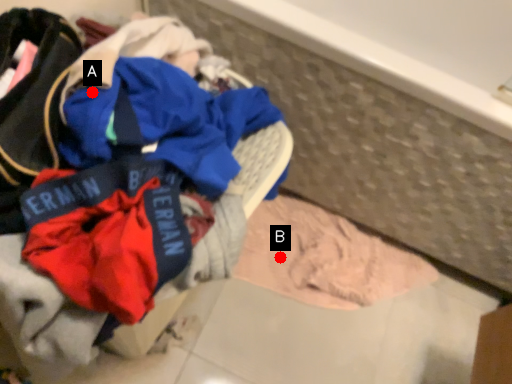
Question: Two points are circled on the image, labeled by A and B beside each circle. Among these points, which one is nearest to the camera?

Choices:
 (A) A is closer
 (B) B is closer

Answer: (A)